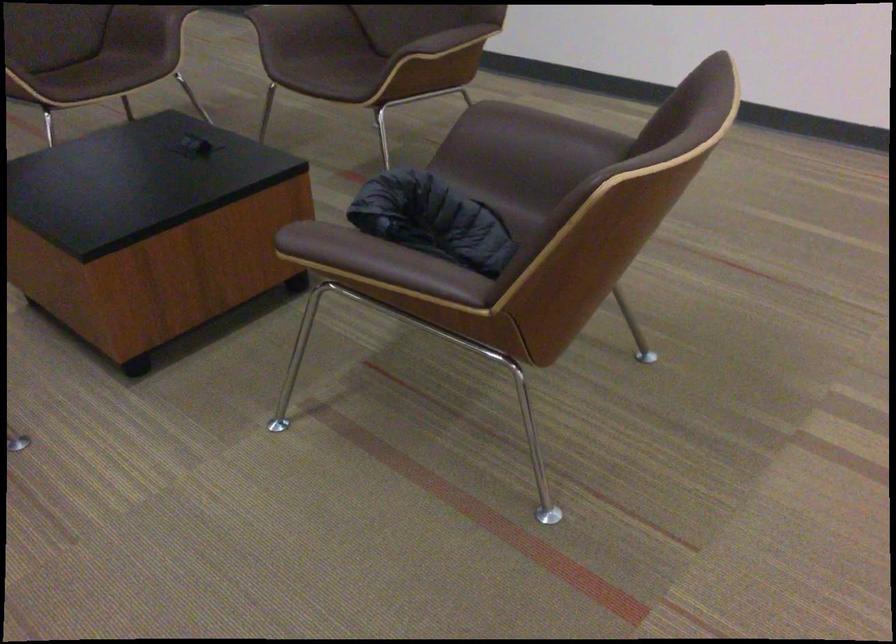
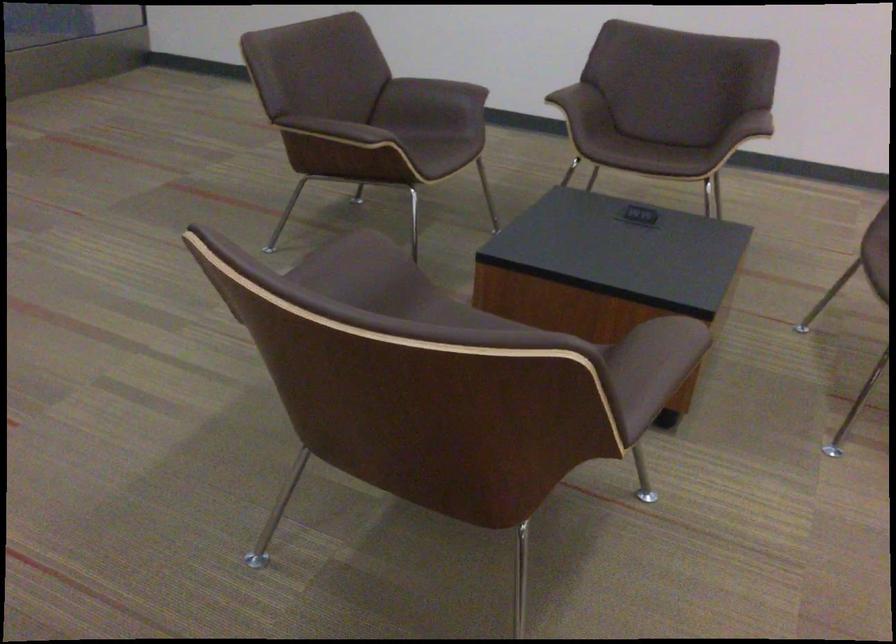
Question: Which direction would the cameraman need to move to produce the second image? Reply with the corresponding letter.

Choices:
 (A) Left
 (B) Right
 (C) Forward
 (D) Backward

Answer: (A)